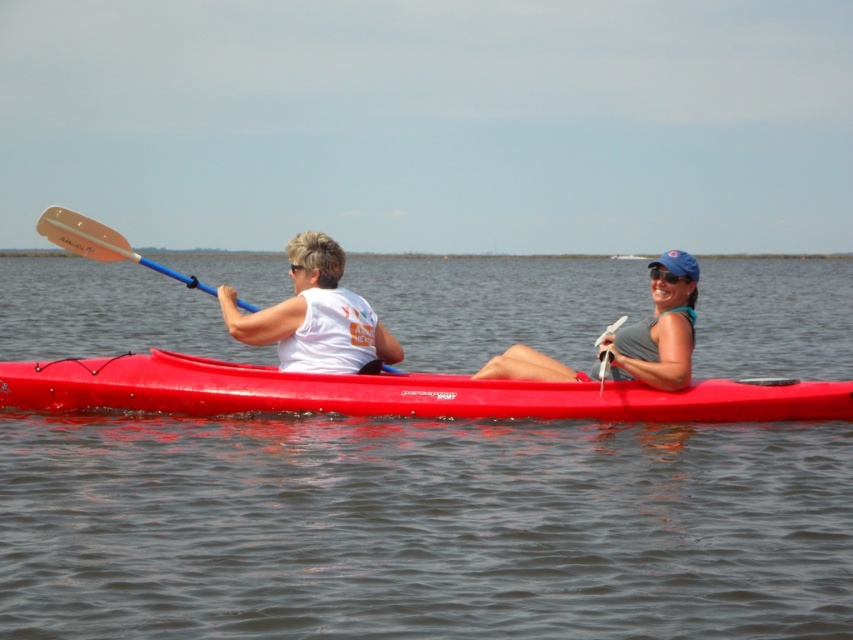
Question: Can you confirm if white matte tank top at center is positioned to the left of translucent plastic paddle at left?

Choices:
 (A) yes
 (B) no

Answer: (B)

Question: Among these points, which one is nearest to the camera?

Choices:
 (A) (428, 536)
 (B) (556, 376)
 (C) (223, 410)

Answer: (A)

Question: Among these objects, which one is farthest from the camera?

Choices:
 (A) transparent water at center
 (B) shiny red kayak at center
 (C) blue matte sunglasses at upper center

Answer: (C)

Question: Is gray fabric tank top at center bigger than blue matte sunglasses at upper center?

Choices:
 (A) yes
 (B) no

Answer: (A)

Question: Estimate the real-world distances between objects in this image. Which object is farther from the white matte tank top at center?

Choices:
 (A) translucent plastic paddle at left
 (B) gray fabric tank top at center
 (C) shiny red kayak at center

Answer: (B)

Question: Can you confirm if transparent water at center is bigger than blue matte sunglasses at upper center?

Choices:
 (A) no
 (B) yes

Answer: (B)